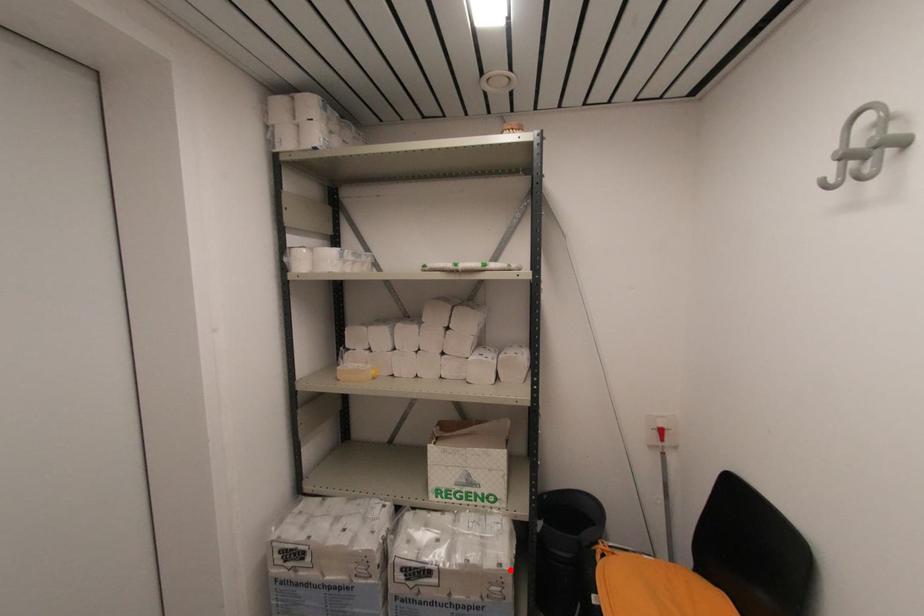
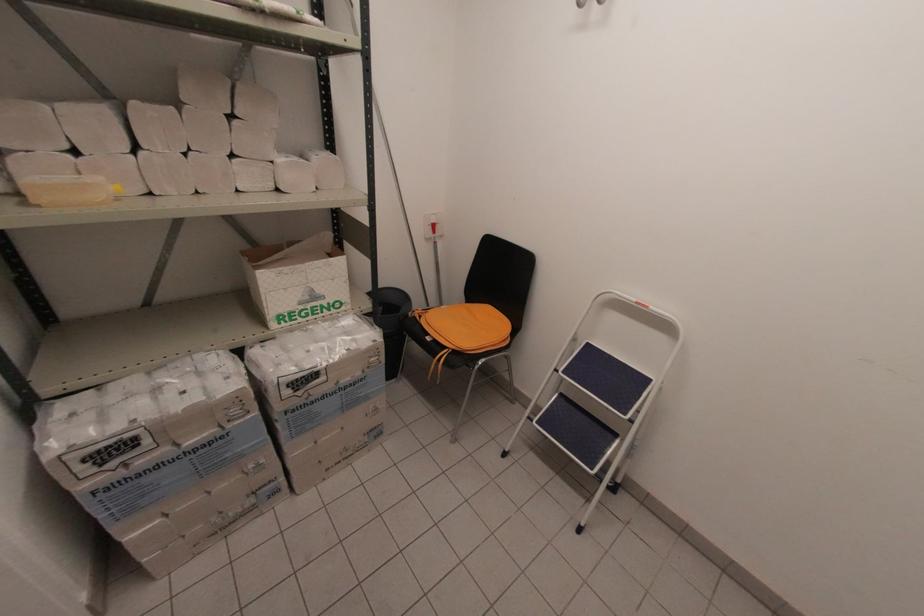
Question: A red point is marked in image1. In image2, is the corresponding 3D point closer to the camera or farther? Reply with the corresponding letter.

Choices:
 (A) The corresponding 3D point is closer.
 (B) The corresponding 3D point is farther.

Answer: (A)